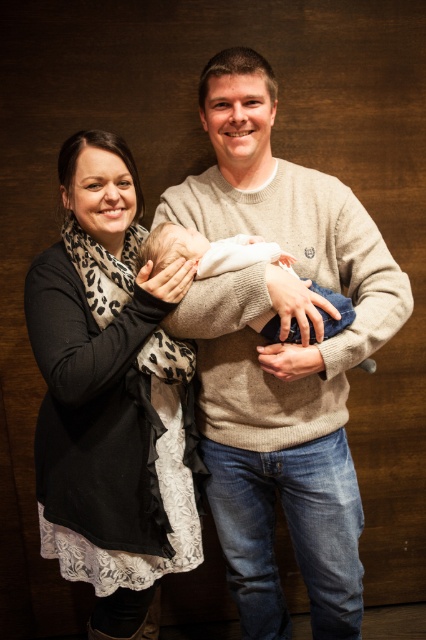
Question: Is black leopard print scarf at left further to camera compared to white soft fabric newborn at center?

Choices:
 (A) yes
 (B) no

Answer: (B)

Question: Can you confirm if knit sweater at center is positioned to the right of white soft fabric newborn at center?

Choices:
 (A) yes
 (B) no

Answer: (A)

Question: Which point is closer to the camera?

Choices:
 (A) knit sweater at center
 (B) white soft fabric newborn at center

Answer: (B)

Question: Estimate the real-world distances between objects in this image. Which object is farther from the knit sweater at center?

Choices:
 (A) black leopard print scarf at left
 (B) white soft fabric newborn at center

Answer: (A)

Question: Does black leopard print scarf at left come in front of white soft fabric newborn at center?

Choices:
 (A) yes
 (B) no

Answer: (A)

Question: Among these objects, which one is nearest to the camera?

Choices:
 (A) white soft fabric newborn at center
 (B) knit sweater at center

Answer: (A)